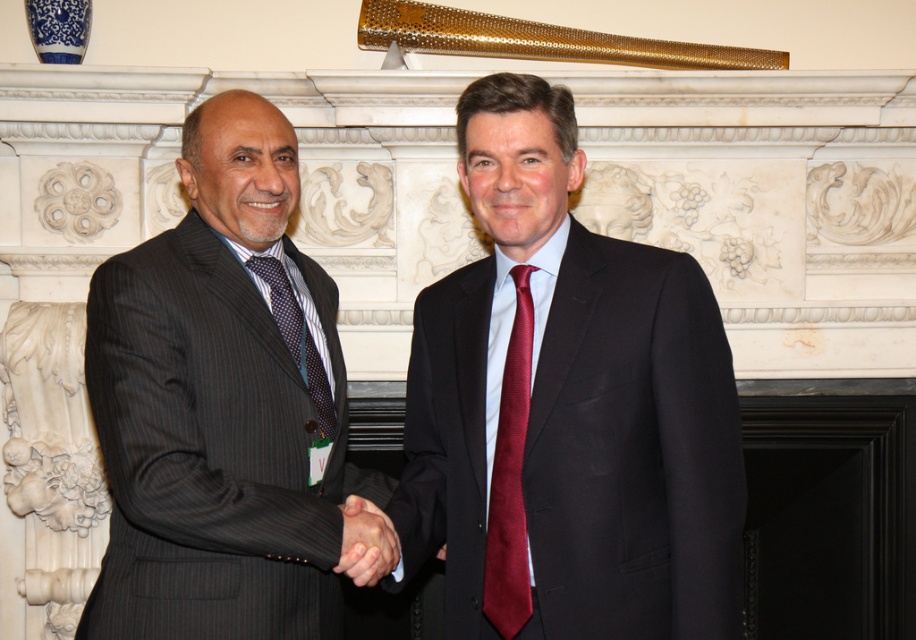
Which is in front, point (273, 500) or point (497, 618)?

Positioned in front is point (273, 500).

Does dark pinstripe suit at left come behind maroon silk tie at center?

No.

Between point (143, 397) and point (520, 563), which one is positioned behind?

Point (520, 563)

You are a GUI agent. You are given a task and a screenshot of the screen. Output one action in this format:
    pyautogui.click(x=<x>, y=<y>)
    Task: Click on the dark pinstripe suit at left
    The width and height of the screenshot is (916, 640).
    Given the screenshot: What is the action you would take?
    pyautogui.click(x=221, y=404)

Does dark blue textured tie at left have a greater width compared to smooth black suit at center?

Yes.

From the picture: Can you confirm if dark blue textured tie at left is positioned above smooth black suit at center?

Yes.

Does point (271, 289) lie in front of point (369, 536)?

No, it is not.

You are a GUI agent. You are given a task and a screenshot of the screen. Output one action in this format:
    pyautogui.click(x=<x>, y=<y>)
    Task: Click on the dark blue textured tie at left
    
    Given the screenshot: What is the action you would take?
    pyautogui.click(x=296, y=337)

Who is positioned more to the right, dark pinstripe suit at left or smooth black suit at center?

Positioned to the right is smooth black suit at center.

How distant is dark pinstripe suit at left from smooth black suit at center?

dark pinstripe suit at left is 11.10 inches from smooth black suit at center.

Is point (245, 419) closer to viewer compared to point (372, 560)?

No, (245, 419) is further to viewer.

You are a GUI agent. You are given a task and a screenshot of the screen. Output one action in this format:
    pyautogui.click(x=<x>, y=<y>)
    Task: Click on the dark pinstripe suit at left
    Image resolution: width=916 pixels, height=640 pixels.
    Given the screenshot: What is the action you would take?
    [x=221, y=404]